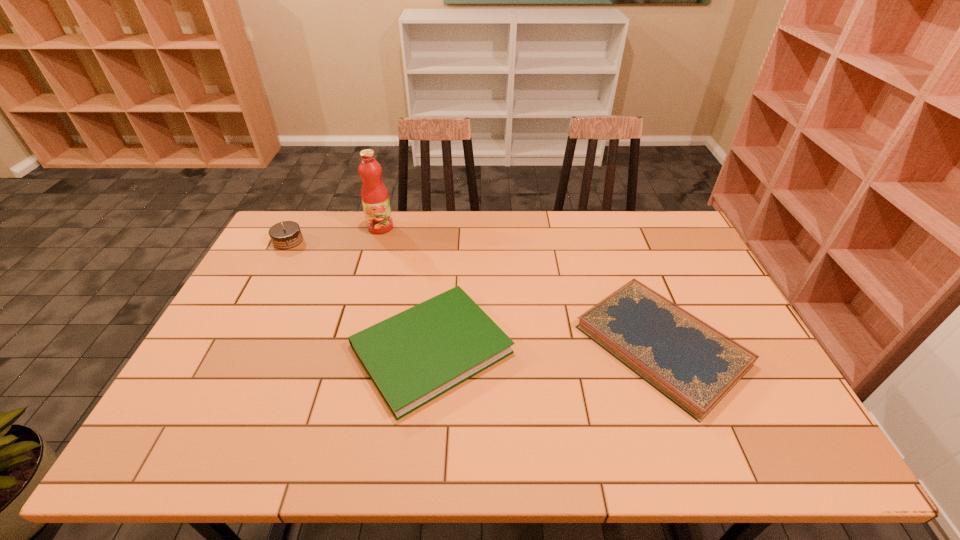
I want to click on chocolate cake located at the far edge, so click(x=285, y=235).

This screenshot has width=960, height=540. In order to click on object at the left edge in this screenshot , I will do `click(285, 235)`.

The width and height of the screenshot is (960, 540). I want to click on object that is positioned at the right edge, so click(x=694, y=365).

The width and height of the screenshot is (960, 540). I want to click on object located in the far left corner section of the desktop, so click(x=285, y=235).

At what (x,y) coordinates should I click in order to perform the action: click on free region at the far edge. Please return your answer as a coordinate pair (x, y). This screenshot has height=540, width=960. Looking at the image, I should click on (514, 222).

Identify the location of vacant area at the near edge. (326, 429).

The width and height of the screenshot is (960, 540). Identify the location of blank space at the left edge of the desktop. (268, 291).

In the image, there is a desktop. In order to click on free space at the right edge in this screenshot , I will do `click(731, 320)`.

Image resolution: width=960 pixels, height=540 pixels. What are the coordinates of `free location at the far right corner` in the screenshot? It's located at (651, 224).

The height and width of the screenshot is (540, 960). Find the location of `vacant area that lies between the left paperback book and the tallest object`. vacant area that lies between the left paperback book and the tallest object is located at coordinates coord(406,288).